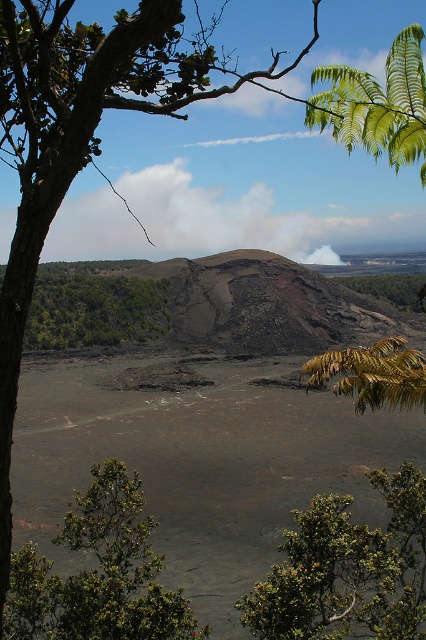
Based on the photo, who is positioned more to the right, green leafy tree at lower left or green leafy shrubs at center?

From the viewer's perspective, green leafy tree at lower left appears more on the right side.

Describe the element at coordinates (98, 573) in the screenshot. I see `green leafy tree at lower left` at that location.

The image size is (426, 640). What do you see at coordinates (98, 573) in the screenshot? I see `green leafy tree at lower left` at bounding box center [98, 573].

Find the location of a particular element. The height and width of the screenshot is (640, 426). green leafy tree at lower left is located at coordinates (98, 573).

Who is shorter, green leafy shrub at lower center or green leafy tree at center?

green leafy tree at center

Does point (345, 611) lie behind point (314, 381)?

Yes, it is behind point (314, 381).

Image resolution: width=426 pixels, height=640 pixels. In order to click on green leafy shrub at lower center in this screenshot , I will do `click(348, 570)`.

Who is positioned more to the right, green leafy shrub at lower center or green leafy tree at lower left?

green leafy shrub at lower center

Which is more to the left, green leafy shrub at lower center or green leafy tree at lower left?

Positioned to the left is green leafy tree at lower left.

Is point (400, 592) positioned before point (89, 609)?

That is False.

Where is `green leafy shrub at lower center`? green leafy shrub at lower center is located at coordinates (348, 570).